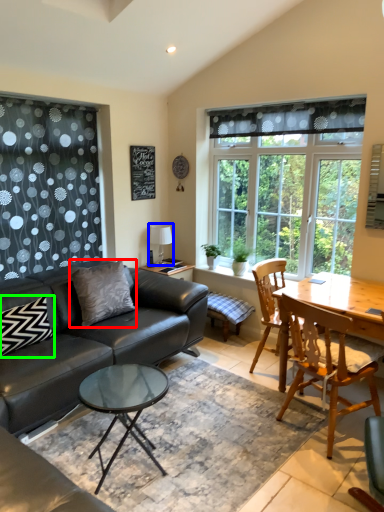
Question: Which object is positioned closest to pillow (highlighted by a red box)? Select from lamp (highlighted by a blue box) and pillow (highlighted by a green box).

Choices:
 (A) lamp
 (B) pillow

Answer: (B)